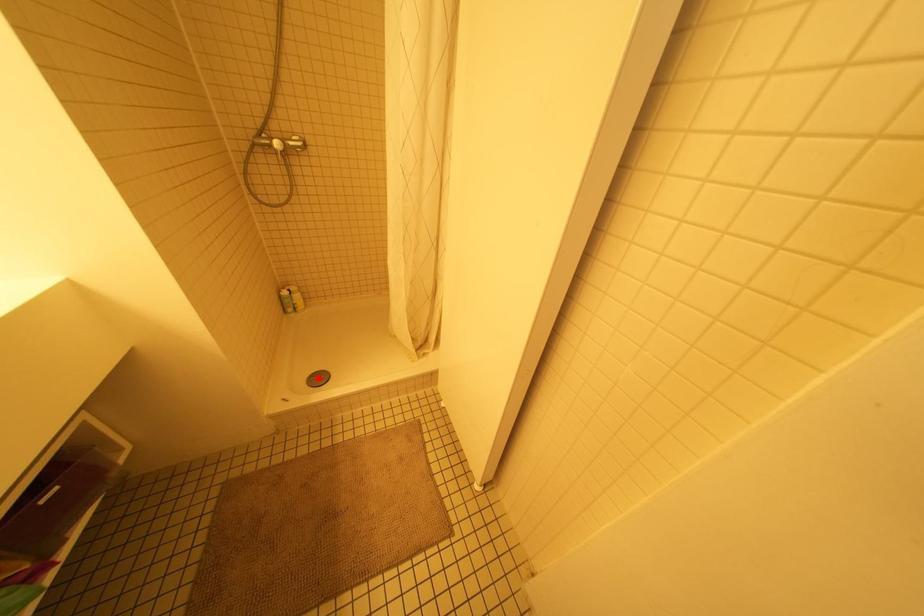
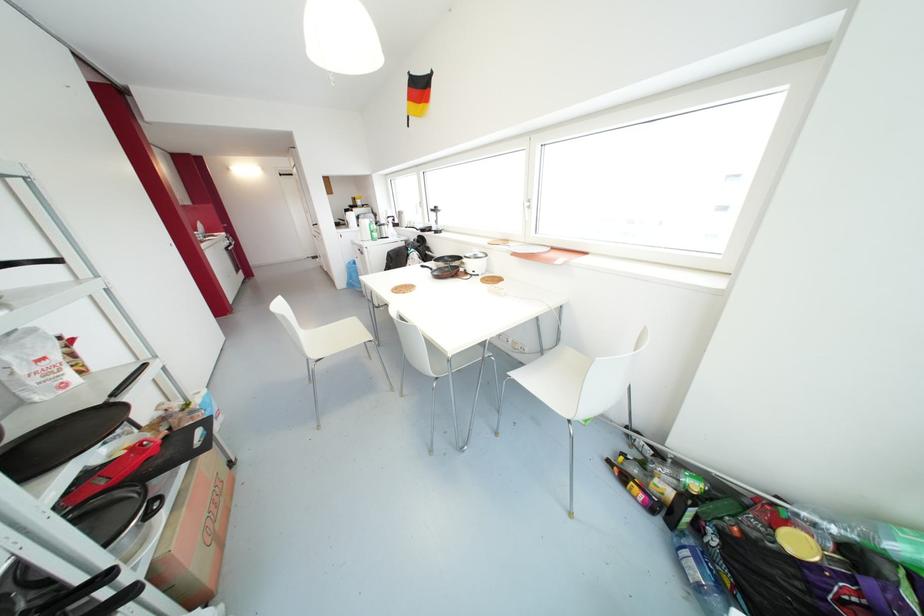
Question: I am providing you with two images of the same scene from different viewpoints. A red point is marked on the first image. At the location where the point appears in image 1, is it still visible in image 2?

Choices:
 (A) Yes
 (B) No

Answer: (B)